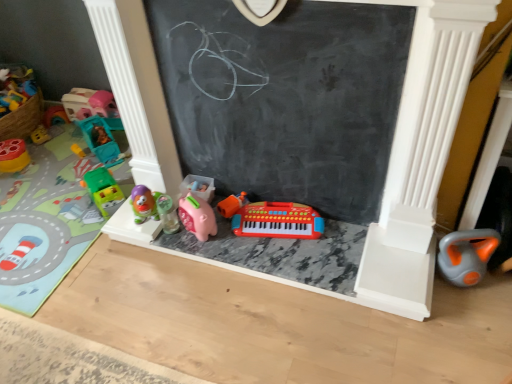
Where is `vacant space to the right of matte yellow and red toy at left, the 1th toy from the left`? The width and height of the screenshot is (512, 384). vacant space to the right of matte yellow and red toy at left, the 1th toy from the left is located at coordinates (47, 159).